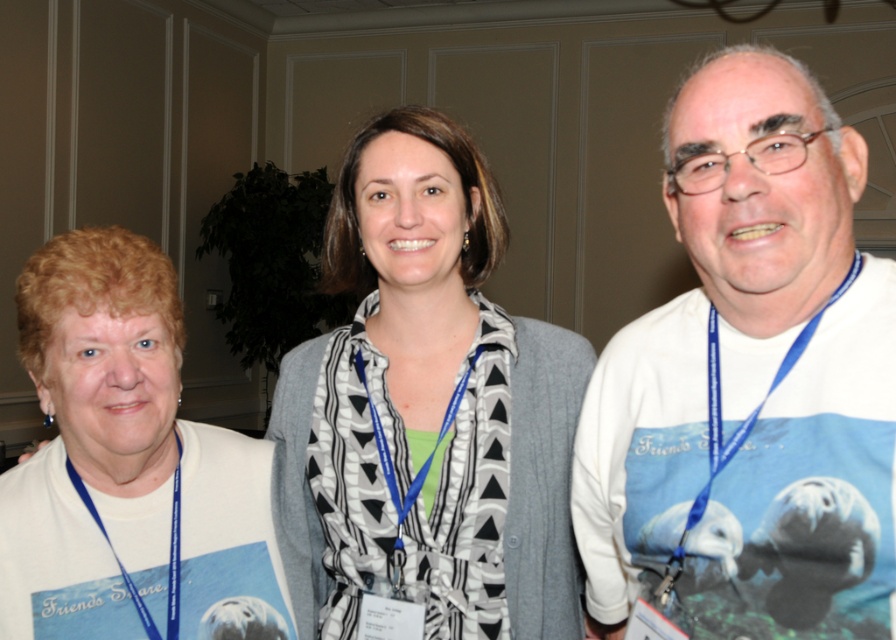
Can you confirm if white matte sweatshirt at center is thinner than blue fabric lanyard at right?

In fact, white matte sweatshirt at center might be wider than blue fabric lanyard at right.

The height and width of the screenshot is (640, 896). What do you see at coordinates (128, 467) in the screenshot?
I see `white matte sweatshirt at center` at bounding box center [128, 467].

What do you see at coordinates (128, 467) in the screenshot? The width and height of the screenshot is (896, 640). I see `white matte sweatshirt at center` at bounding box center [128, 467].

Locate an element on the screen. white matte sweatshirt at center is located at coordinates (128, 467).

Is blue fabric lanyard at right wider than blue fabric lanyard at left?

Yes.

Between blue fabric lanyard at right and blue fabric lanyard at left, which one has more height?

With more height is blue fabric lanyard at right.

Who is more forward, (700, 516) or (119, 563)?

Point (700, 516)

Identify the location of blue fabric lanyard at right. The height and width of the screenshot is (640, 896). (724, 445).

Can you confirm if white cotton shirt at center is positioned below white matte sweatshirt at center?

Actually, white cotton shirt at center is above white matte sweatshirt at center.

Does white cotton shirt at center have a greater width compared to white matte sweatshirt at center?

Incorrect, white cotton shirt at center's width does not surpass white matte sweatshirt at center's.

Locate an element on the screen. This screenshot has height=640, width=896. white cotton shirt at center is located at coordinates (750, 381).

Image resolution: width=896 pixels, height=640 pixels. What are the coordinates of `white cotton shirt at center` in the screenshot? It's located at (750, 381).